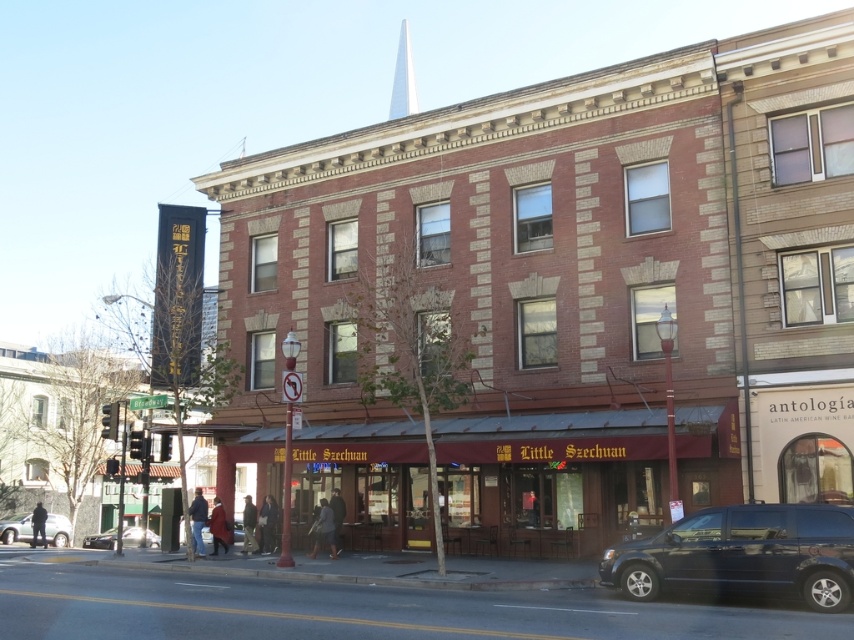
You are a delivery driver who needs to park your shiny black van at lower right as close as possible to the white smooth spire at upper center. Given that the minimum parking distance required by the city is 200 feet, can you park your van there?

The distance between the shiny black van at lower right and the white smooth spire at upper center is 213.67 feet, which exceeds the 200 feet minimum requirement. Therefore, you can park the van there.

You are a delivery person needing to park your vehicle in a tight space near the Little Szechuan restaurant. You have two options for parking spots next to the shiny black van at lower right and the silver metallic sedan at lower left. Which vehicle should you choose to ensure your delivery van can fit in the available space?

The shiny black van at lower right has a smaller size compared to the silver metallic sedan at lower left. Therefore, the delivery van should choose the parking spot next to the shiny black van at lower right as it is more likely to accommodate the vehicle size.

You are a pedestrian standing on the sidewalk in front of the Little Szechuan restaurant. You need to cross the street safely. Looking at the shiny black van at lower right and the silver metallic sedan at lower left, which vehicle is closer to your right side?

The shiny black van at lower right is closer to your right side since it is positioned to the right of the silver metallic sedan at lower left.